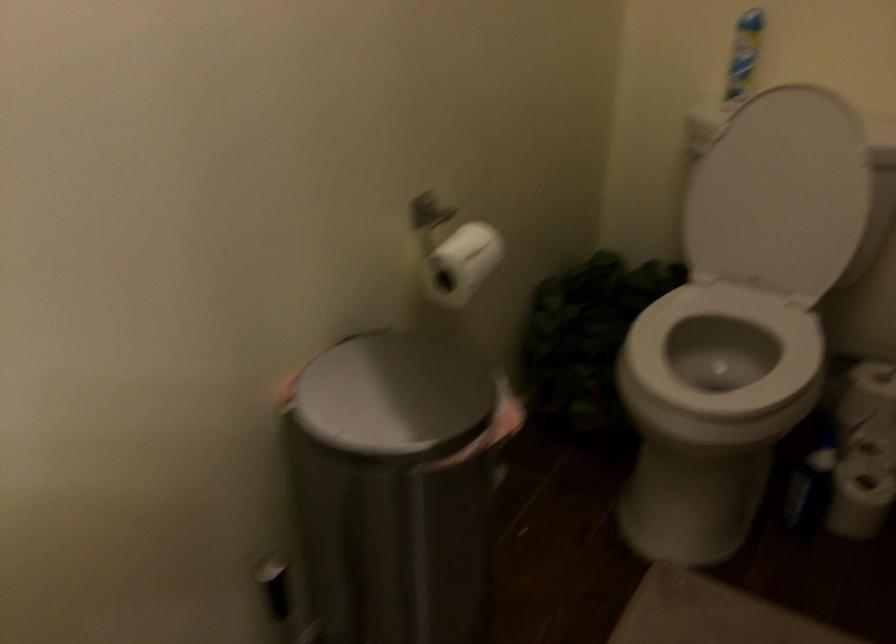
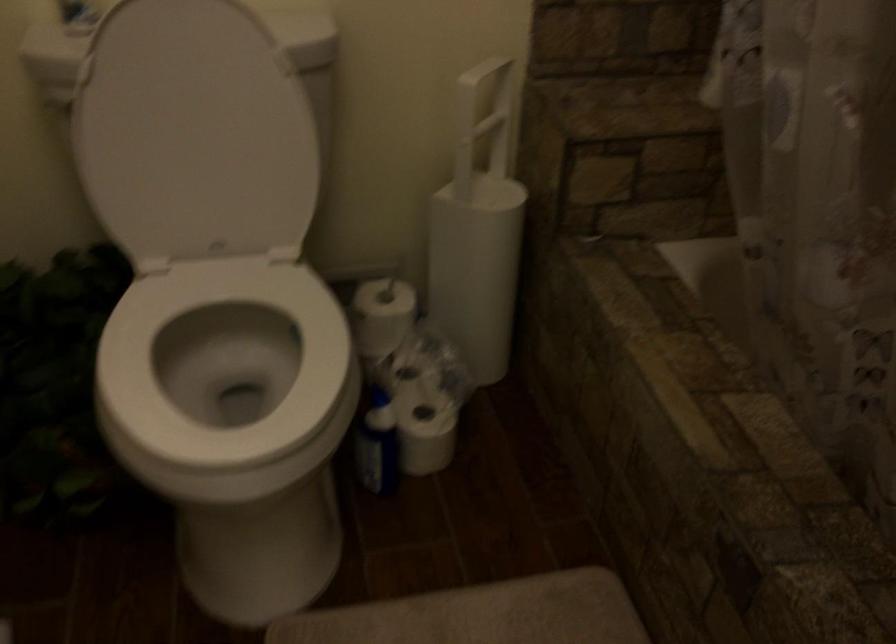
Find the pixel in the second image that matches pixel 716 368 in the first image.

(224, 365)